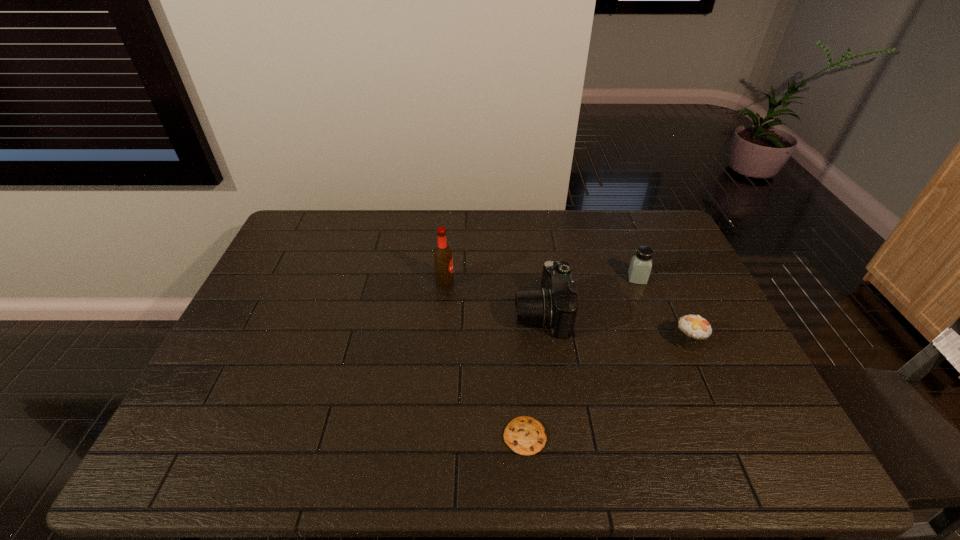
I want to click on free space between the cupcake and the cookie, so point(607,389).

In order to click on the second closest object relative to the third tallest object in this screenshot , I will do `click(554, 306)`.

Image resolution: width=960 pixels, height=540 pixels. Identify the location of object that is the fourth closest to the shortest object. (639, 271).

The width and height of the screenshot is (960, 540). What are the coordinates of `free space that satisfies the following two spatial constraints: 1. on the back side of the cupcake; 2. on the right side of the cookie` in the screenshot? It's located at (517, 341).

You are a GUI agent. You are given a task and a screenshot of the screen. Output one action in this format:
    pyautogui.click(x=<x>, y=<y>)
    Task: Click on the free space that satisfies the following two spatial constraints: 1. on the front side of the cupcake; 2. on the right side of the beer bottle
    The width and height of the screenshot is (960, 540).
    Given the screenshot: What is the action you would take?
    pyautogui.click(x=440, y=341)

Identify the location of free region that satisfies the following two spatial constraints: 1. on the front side of the fourth tallest object; 2. on the left side of the third shortest object. (661, 341).